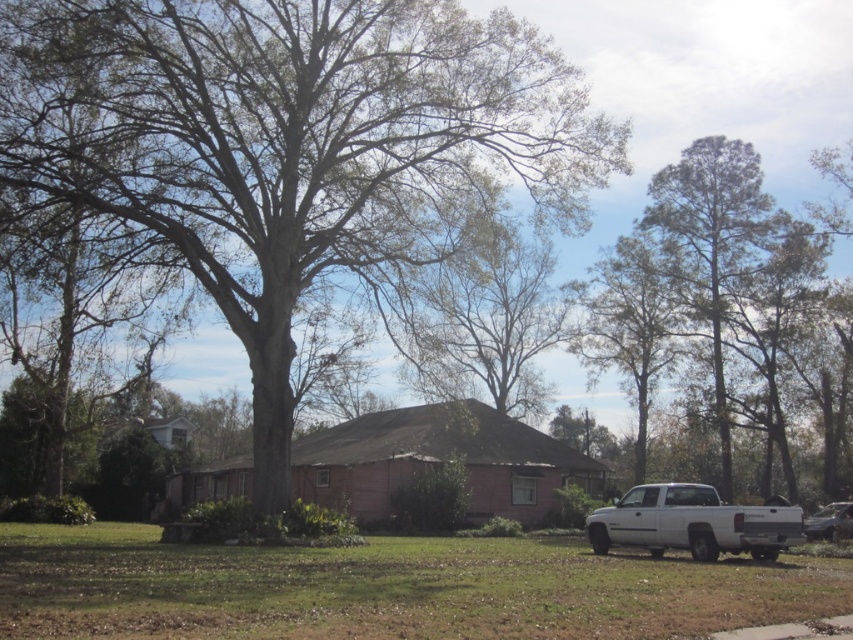
Between point (575, 608) and point (662, 536), which one is positioned in front?

Point (575, 608) is in front.

Can you confirm if green grass at lower right is bigger than white matte truck at lower right?

Indeed, green grass at lower right has a larger size compared to white matte truck at lower right.

Is point (103, 634) closer to viewer compared to point (645, 496)?

Yes, point (103, 634) is in front of point (645, 496).

Find the location of a particular element. This screenshot has width=853, height=640. green grass at lower right is located at coordinates (389, 588).

Between bare wood tree at center and white matte truck at lower right, which one appears on the left side from the viewer's perspective?

bare wood tree at center is more to the left.

Is point (207, 44) positioned behind point (788, 509)?

Yes, it is.

Image resolution: width=853 pixels, height=640 pixels. What are the coordinates of `bare wood tree at center` in the screenshot? It's located at (288, 145).

Can you confirm if white matte truck at lower right is smaller than metallic silver sedan at lower right?

No, white matte truck at lower right is not smaller than metallic silver sedan at lower right.

Based on the photo, who is lower down, white matte truck at lower right or metallic silver sedan at lower right?

Positioned lower is white matte truck at lower right.

Between point (701, 518) and point (851, 504), which one is positioned behind?

The point (851, 504) is more distant.

Locate an element on the screen. white matte truck at lower right is located at coordinates (693, 524).